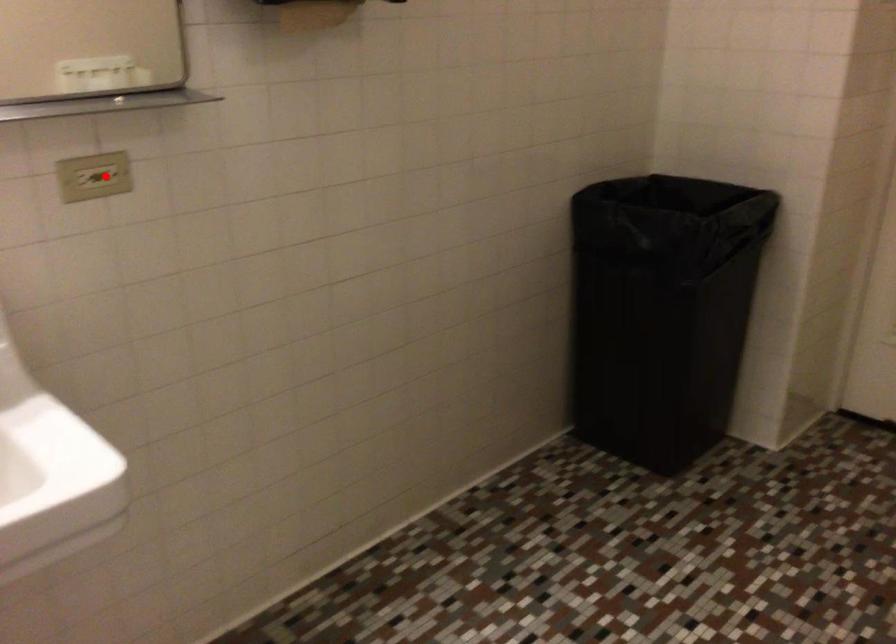
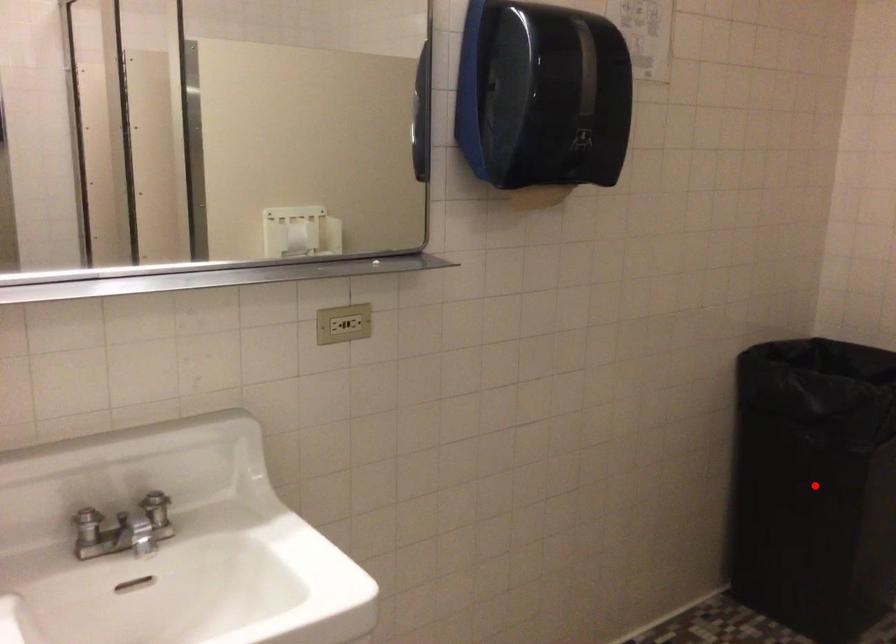
I am providing you with two images of the same scene from different viewpoints. A red point is marked on the first image and another point is marked on the second image. Does the point marked in image1 correspond to the same location as the one in image2?

No